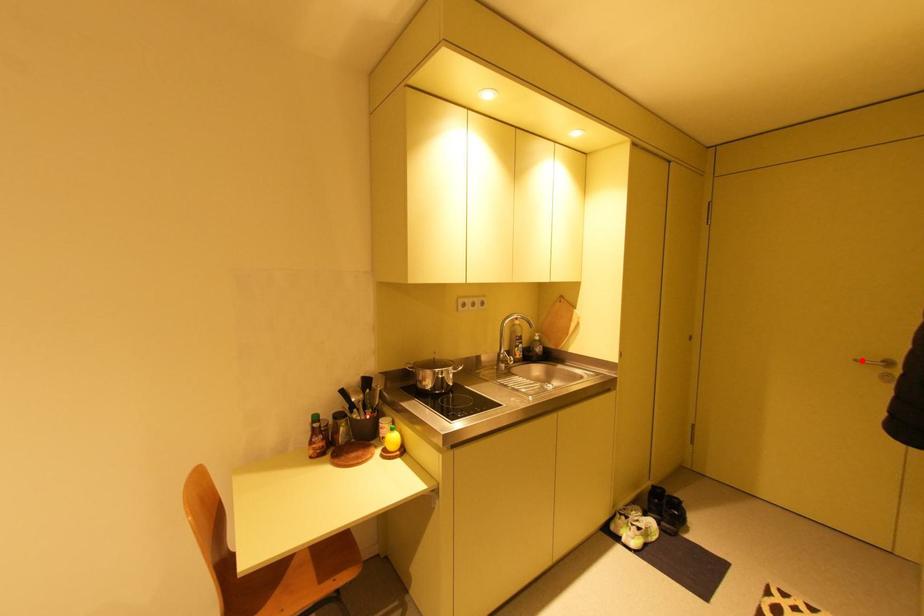
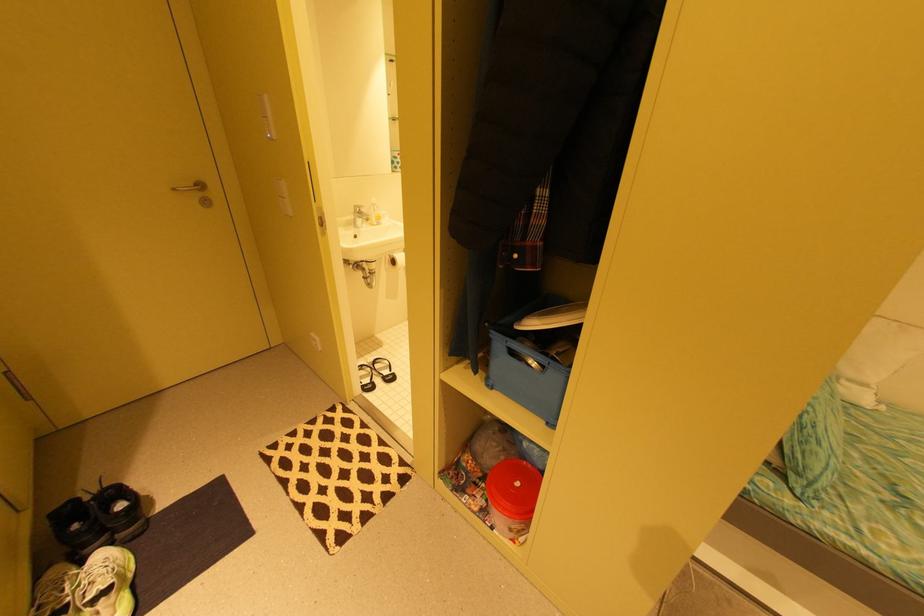
Question: I am providing you with two images of the same scene from different viewpoints. A red point is marked on the first image. Is the red point's position out of view in image 2?

Choices:
 (A) Yes
 (B) No

Answer: (B)